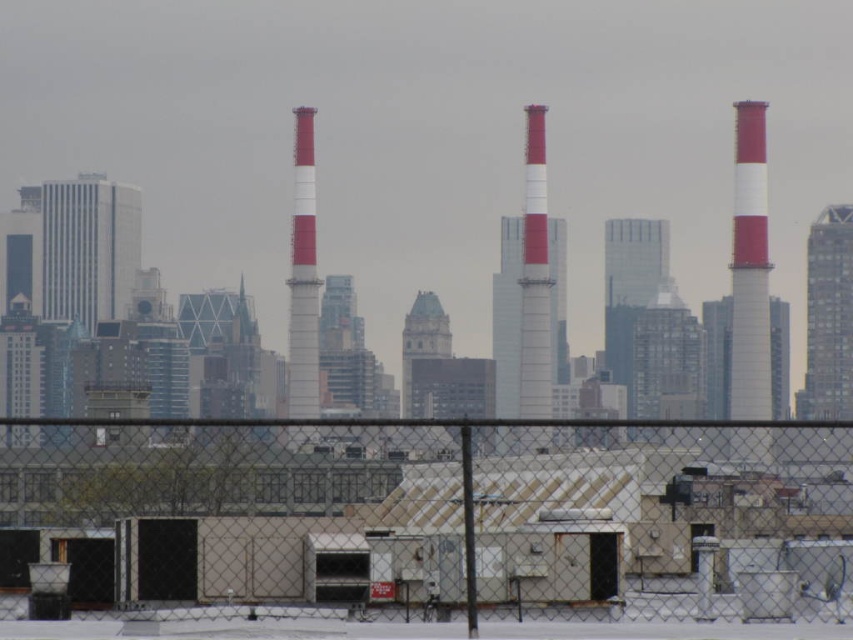
Question: Can you confirm if chain link fence at lower center is thinner than white painted metal chimney at center?

Choices:
 (A) no
 (B) yes

Answer: (A)

Question: Which point is closer to the camera?

Choices:
 (A) (x=764, y=460)
 (B) (x=360, y=452)
 (C) (x=529, y=304)

Answer: (B)

Question: Among these points, which one is nearest to the camera?

Choices:
 (A) (306, 198)
 (B) (32, 436)
 (C) (566, 602)

Answer: (A)

Question: Which point appears closest to the camera in this image?

Choices:
 (A) (115, 429)
 (B) (302, 150)
 (C) (543, 273)
 (D) (753, 216)

Answer: (C)

Question: Does white striped chimney at center have a smaller size compared to white painted metal chimney at center?

Choices:
 (A) yes
 (B) no

Answer: (B)

Question: Does white smooth chimneys at center have a lesser width compared to matte white and red chimney at right?

Choices:
 (A) no
 (B) yes

Answer: (A)